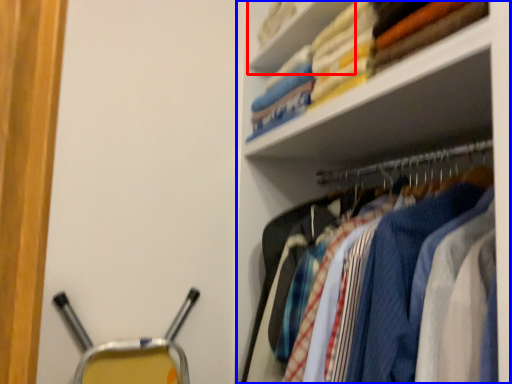
Question: Which point is further to the camera, cabinet (highlighted by a red box) or shelf (highlighted by a blue box)?

Choices:
 (A) cabinet
 (B) shelf

Answer: (A)